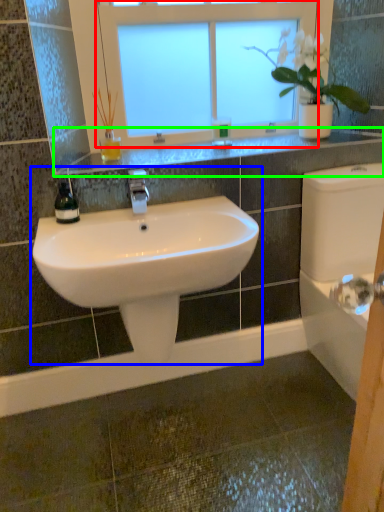
Question: Which is nearer to the window (highlighted by a red box)? sink (highlighted by a blue box) or window sill (highlighted by a green box).

Choices:
 (A) sink
 (B) window sill

Answer: (B)